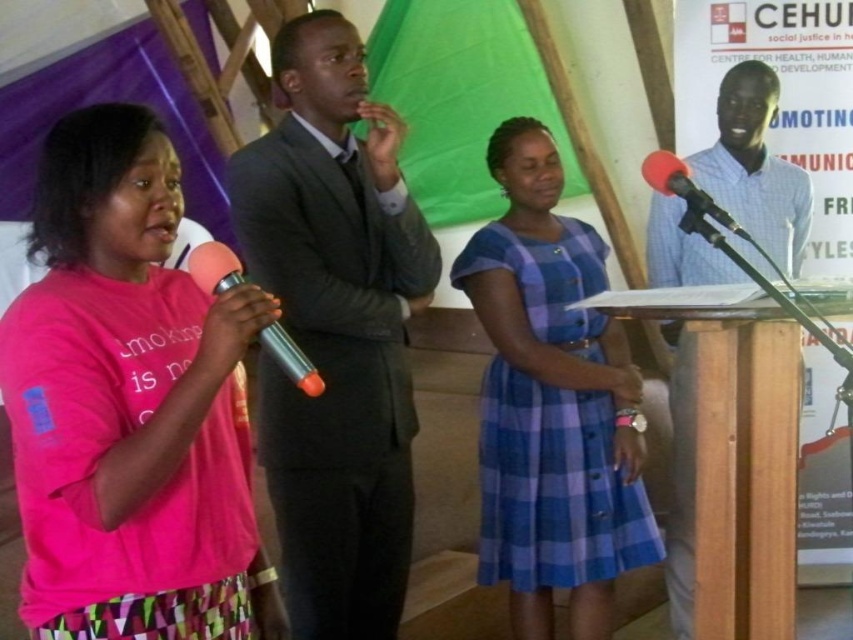
Question: Which point is closer to the camera?

Choices:
 (A) (305, 380)
 (B) (109, 593)

Answer: (A)

Question: In this image, where is blue checkered shirt at center located relative to rubberized red microphone at right?

Choices:
 (A) right
 (B) left

Answer: (A)

Question: Considering the real-world distances, which object is closest to the blue checkered shirt at center?

Choices:
 (A) pink fabric shirt at left
 (B) rubberized red microphone at right
 (C) blue plaid dress at center

Answer: (C)

Question: Is pink fabric shirt at left smaller than pink metallic microphone at left?

Choices:
 (A) no
 (B) yes

Answer: (A)

Question: Is pink fabric shirt at left to the left of rubberized red microphone at right from the viewer's perspective?

Choices:
 (A) no
 (B) yes

Answer: (B)

Question: Estimate the real-world distances between objects in this image. Which object is farther from the pink fabric shirt at left?

Choices:
 (A) blue checkered shirt at center
 (B) blue plaid dress at center

Answer: (A)